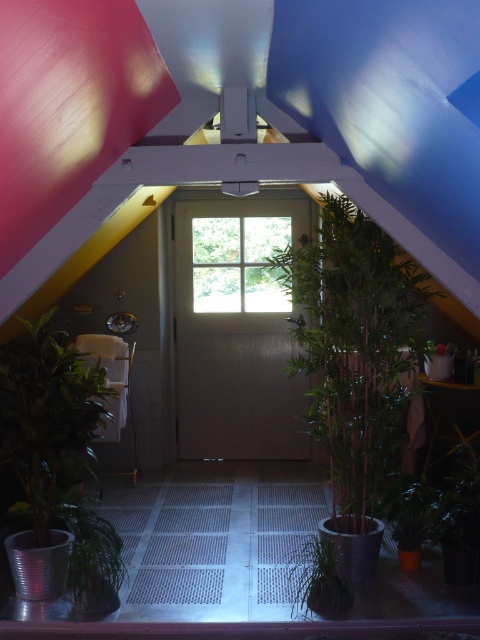
The height and width of the screenshot is (640, 480). I want to click on green bamboo at center, so click(x=354, y=346).

Is green bamboo at center further to camera compared to green matte plant at center?

Yes.

Find the location of a particular element. green bamboo at center is located at coordinates 354,346.

Which is behind, point (16, 589) or point (328, 538)?

The point (16, 589) is more distant.

Does green leafy plant at left have a larger size compared to green matte plant at center?

Indeed, green leafy plant at left has a larger size compared to green matte plant at center.

Is point (79, 397) positioned in front of point (333, 566)?

No, it is not.

You are a GUI agent. You are given a task and a screenshot of the screen. Output one action in this format:
    pyautogui.click(x=<x>, y=<y>)
    Task: Click on the green leafy plant at left
    The height and width of the screenshot is (640, 480).
    Given the screenshot: What is the action you would take?
    pyautogui.click(x=55, y=467)

Based on the photo, does green leafy plant at left have a larger size compared to clear glass window at center?

No, green leafy plant at left is not bigger than clear glass window at center.

Is green leafy plant at left thinner than clear glass window at center?

Correct, green leafy plant at left's width is less than clear glass window at center's.

Which is in front, point (56, 456) or point (265, 298)?

Point (56, 456) is in front.

The image size is (480, 640). What are the coordinates of `green leafy plant at left` in the screenshot? It's located at (55, 467).